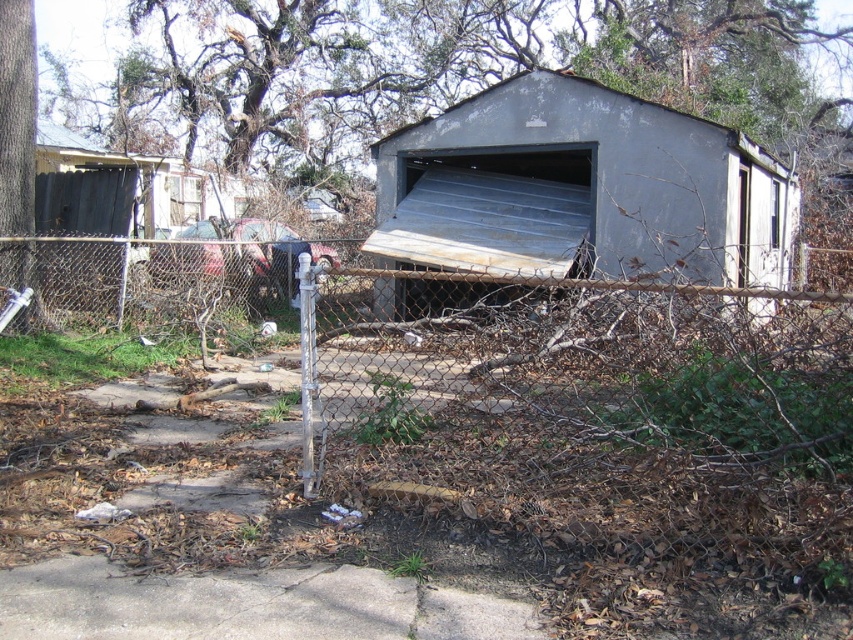
Is rusty metal shed at center behind rusty metal garage door at center?

Yes.

From the picture: Who is lower down, rusty metal shed at center or rusty metal garage door at center?

rusty metal garage door at center

Who is more forward, (444, 291) or (438, 228)?

Point (438, 228)

Find the location of a particular element. rusty metal shed at center is located at coordinates (581, 189).